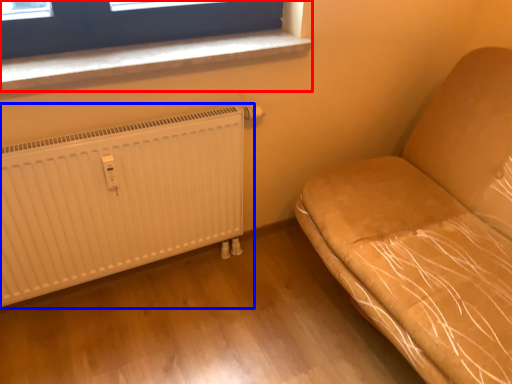
Question: Which object appears closest to the camera in this image, window (highlighted by a red box) or radiator (highlighted by a blue box)?

Choices:
 (A) window
 (B) radiator

Answer: (B)